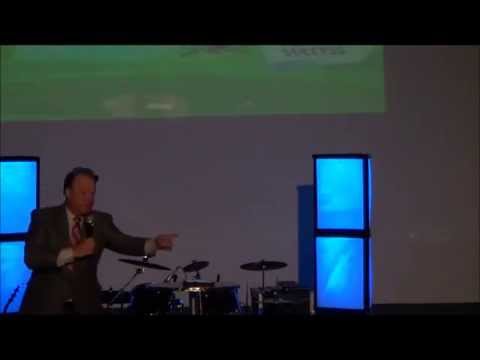
You are a GUI agent. You are given a task and a screenshot of the screen. Output one action in this format:
    pyautogui.click(x=<x>, y=<y>)
    Task: Click on the blue lights
    
    Given the screenshot: What is the action you would take?
    pyautogui.click(x=22, y=205), pyautogui.click(x=13, y=272), pyautogui.click(x=338, y=192), pyautogui.click(x=358, y=270)